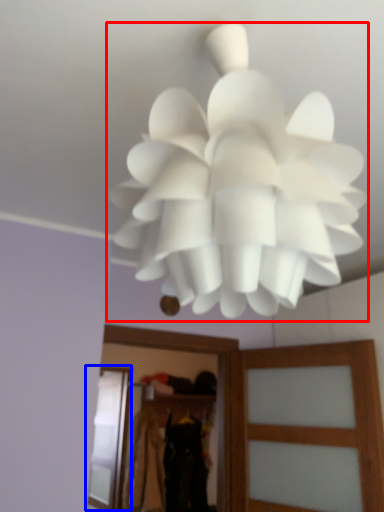
Question: Which object appears closest to the camera in this image, lamp (highlighted by a red box) or screen door (highlighted by a blue box)?

Choices:
 (A) lamp
 (B) screen door

Answer: (A)